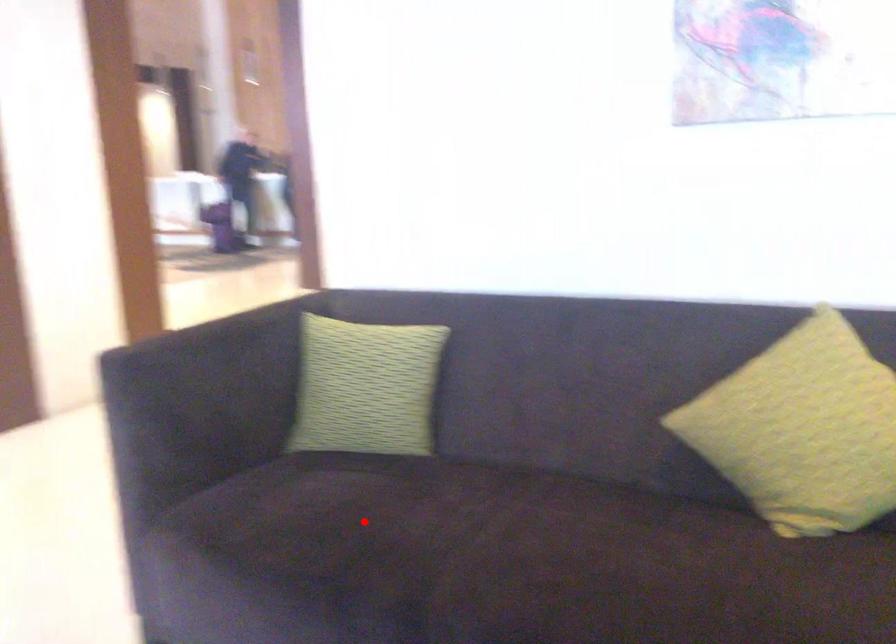
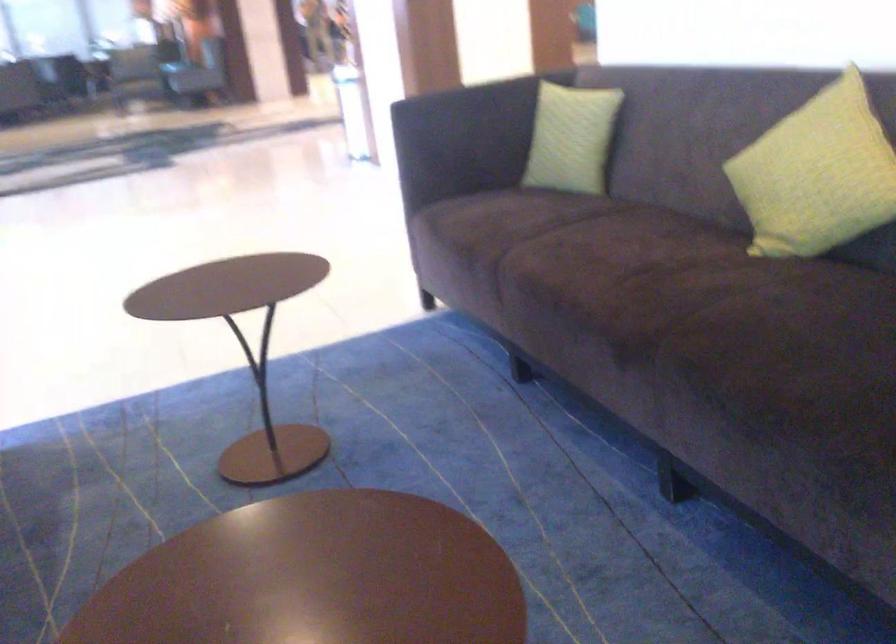
In the second image, find the point that corresponds to the highlighted location in the first image.

(509, 221)